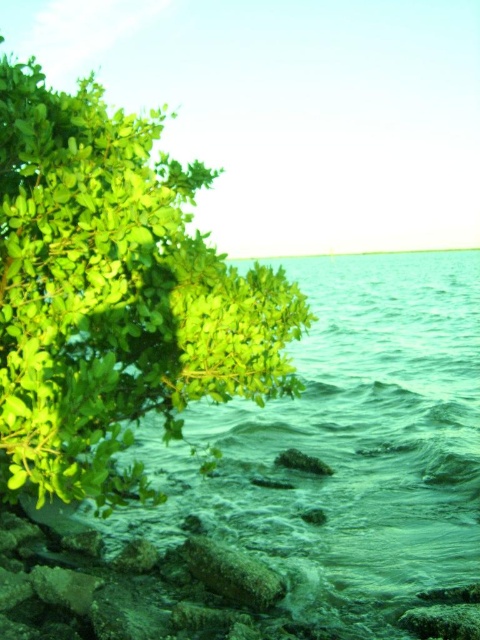
You are standing on the shore looking at the scene. Which object is positioned to the left of the other between the green leafy tree at left and the green translucent water at lower left?

The green leafy tree at left is positioned to the left of the green translucent water at lower left.

You are standing on the beach and want to take a photo of both the green leafy tree at left and the green translucent water at lower left. Which object should you frame first in your camera to ensure both are fully visible in the photo?

The green leafy tree at left has a lesser width compared to green translucent water at lower left, so you should frame the wider green translucent water at lower left first to accommodate its larger size and then adjust the camera to include the narrower green leafy tree at left.